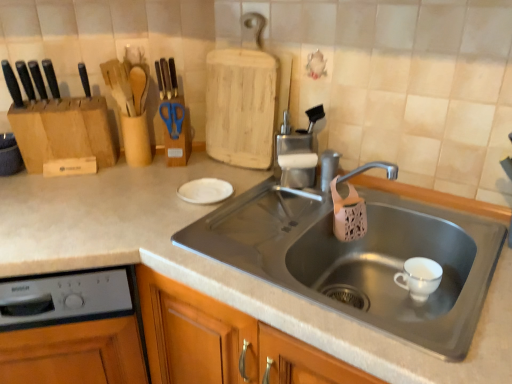
I want to click on free point behind black plastic knife at left, which is the 2th knife in left-to-right order, so click(58, 99).